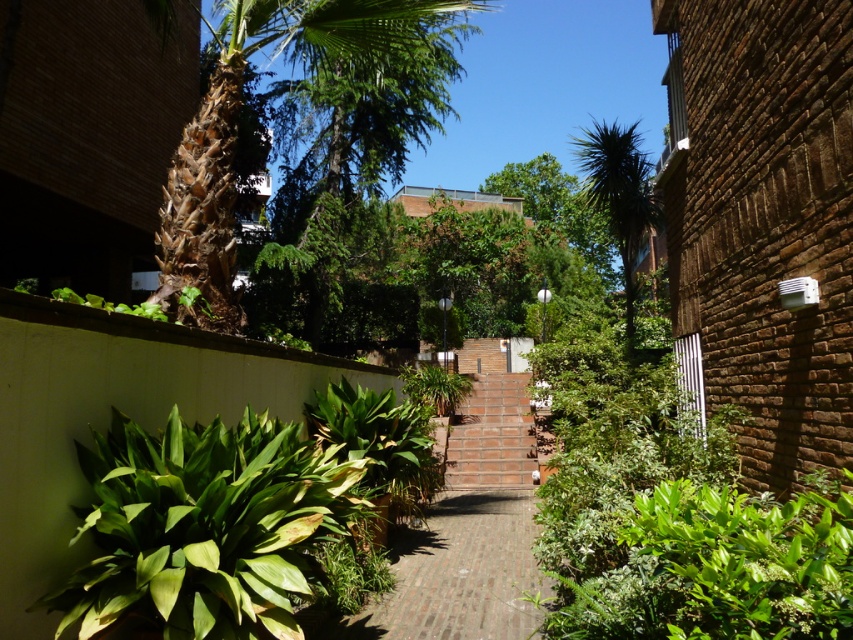
Question: Is brick at center closer to the viewer compared to brown textured palm tree at upper left?

Choices:
 (A) no
 (B) yes

Answer: (B)

Question: Does brick at center appear under brown textured palm tree at upper left?

Choices:
 (A) no
 (B) yes

Answer: (B)

Question: Which point appears closest to the camera in this image?

Choices:
 (A) (218, 248)
 (B) (438, 612)
 (C) (637, 241)

Answer: (B)

Question: Which of these objects is positioned farthest from the green leafy palm tree at center?

Choices:
 (A) brown textured palm tree at upper left
 (B) brick at center

Answer: (A)

Question: Can you confirm if brick at center is positioned below green leafy palm tree at center?

Choices:
 (A) yes
 (B) no

Answer: (A)

Question: Which of the following is the closest to the observer?

Choices:
 (A) brick at center
 (B) green leafy palm tree at center
 (C) brown textured palm tree at upper left

Answer: (A)